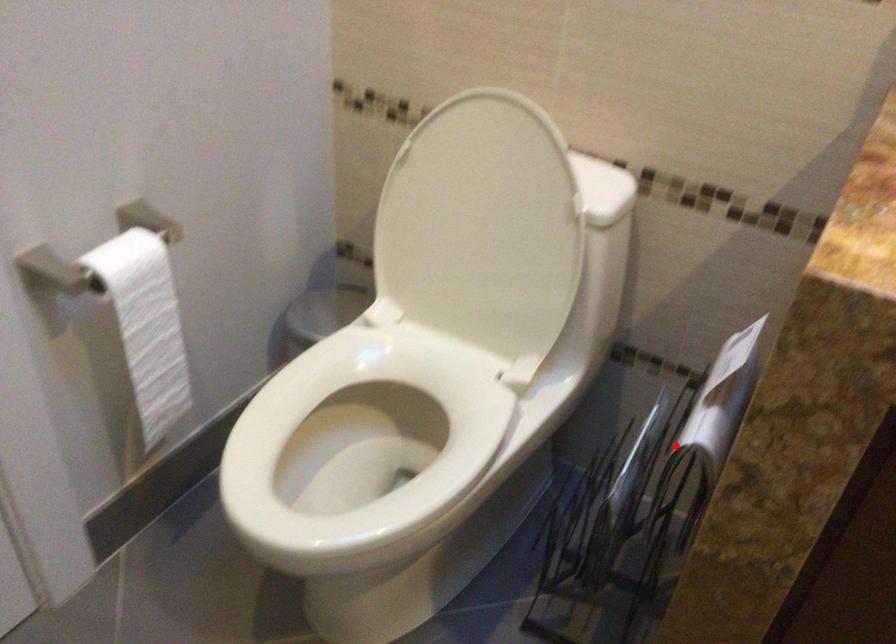
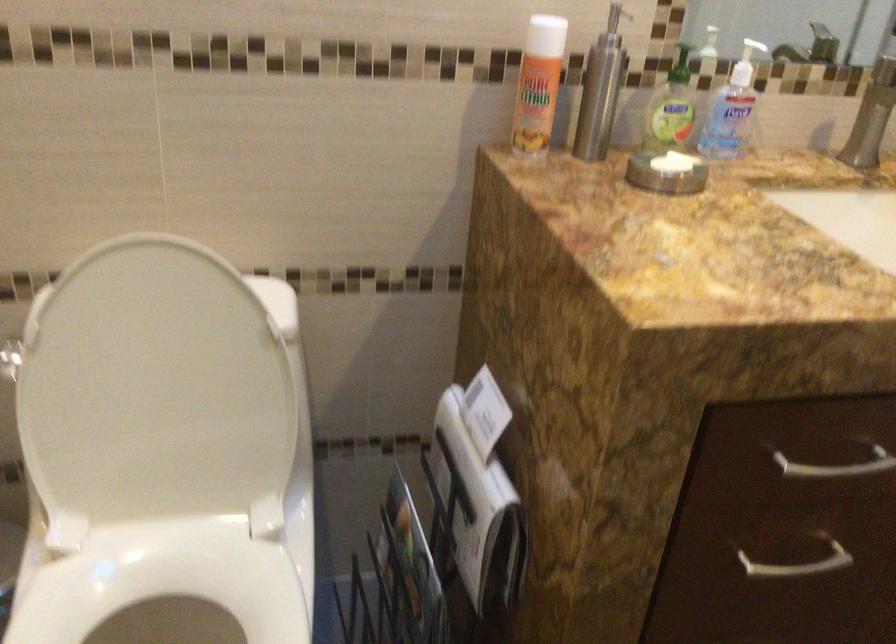
Question: I am providing you with two images of the same scene from different viewpoints. Image1 has a red point marked. In image2, the corresponding 3D location appears at what relative position? Reply with the corresponding letter.

Choices:
 (A) Closer
 (B) Farther

Answer: (B)